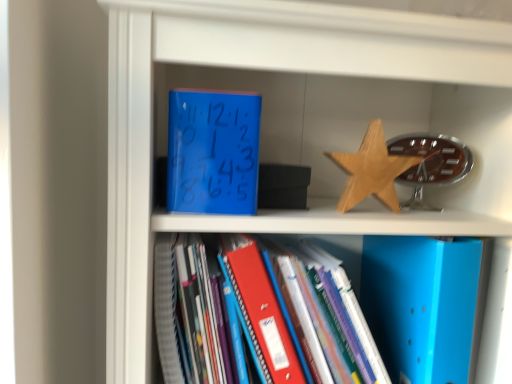
Describe the element at coordinates (422, 304) in the screenshot. I see `blue matte folder at lower right, which is the second paperback book from top to bottom` at that location.

Identify the location of blue matte folder at center. (259, 314).

From the image's perspective, which one is positioned lower, blue matte folder at lower right, which is the second paperback book from top to bottom, or wooden star at upper right?

From the image's view, blue matte folder at lower right, which is the second paperback book from top to bottom, is below.

Does point (458, 350) lie behind point (378, 161)?

That is False.

Which is more to the left, blue matte folder at lower right, which is the second paperback book from top to bottom, or wooden star at upper right?

wooden star at upper right.

Is blue matte folder at lower right, which is the second paperback book from top to bottom, turned away from wooden star at upper right?

blue matte folder at lower right, which is the second paperback book from top to bottom, does not have its back to wooden star at upper right.

Which object is closer to the camera taking this photo, blue matte clock at upper center, which is the 1th paperback book in left-to-right order, or blue matte folder at lower right, which is the second paperback book from top to bottom?

blue matte clock at upper center, which is the 1th paperback book in left-to-right order, is more forward.

From the image's perspective, which object appears higher, blue matte clock at upper center, placed as the second paperback book when sorted from bottom to top, or blue matte folder at lower right, the first paperback book ordered from the bottom?

blue matte clock at upper center, placed as the second paperback book when sorted from bottom to top, from the image's perspective.

Based on their sizes in the image, would you say blue matte clock at upper center, which is the 1th paperback book in left-to-right order, is bigger or smaller than blue matte folder at lower right, acting as the first paperback book starting from the right?

Considering their sizes, blue matte clock at upper center, which is the 1th paperback book in left-to-right order, takes up less space than blue matte folder at lower right, acting as the first paperback book starting from the right.

Is blue matte folder at lower right, acting as the first paperback book starting from the right, inside or outside of blue matte folder at center?

blue matte folder at lower right, acting as the first paperback book starting from the right, is not enclosed by blue matte folder at center.

From a real-world perspective, which is physically above, blue matte folder at lower right, which ranks as the second paperback book in left-to-right order, or blue matte folder at center?

blue matte folder at lower right, which ranks as the second paperback book in left-to-right order, from a real-world perspective.

From the image's perspective, is blue matte folder at lower right, the first paperback book ordered from the bottom, under blue matte folder at center?

Actually, blue matte folder at lower right, the first paperback book ordered from the bottom, appears above blue matte folder at center in the image.

Is blue matte folder at lower right, which is the second paperback book from top to bottom, facing away from blue matte folder at center?

No, blue matte folder at lower right, which is the second paperback book from top to bottom, is not facing away from blue matte folder at center.

Is blue matte clock at upper center, the first paperback book from the top, completely or partially outside of blue matte folder at center?

Yes, blue matte clock at upper center, the first paperback book from the top, is outside of blue matte folder at center.

In terms of width, does blue matte clock at upper center, which is the 1th paperback book in left-to-right order, look wider or thinner when compared to blue matte folder at center?

Considering their sizes, blue matte clock at upper center, which is the 1th paperback book in left-to-right order, looks slimmer than blue matte folder at center.

In the image, is blue matte clock at upper center, which is the 1th paperback book in left-to-right order, positioned in front of or behind blue matte folder at center?

blue matte clock at upper center, which is the 1th paperback book in left-to-right order, is behind blue matte folder at center.

The width and height of the screenshot is (512, 384). I want to click on paperback book that appears on the left of blue matte folder at center, so click(213, 152).

Considering the sizes of objects blue matte folder at center and blue matte clock at upper center, the first paperback book from the top, in the image provided, who is smaller, blue matte folder at center or blue matte clock at upper center, the first paperback book from the top,?

blue matte clock at upper center, the first paperback book from the top, is smaller.

Image resolution: width=512 pixels, height=384 pixels. In order to click on book directly beneath the blue matte clock at upper center, which is the 1th paperback book in left-to-right order (from a real-world perspective) in this screenshot , I will do `click(259, 314)`.

Looking at their sizes, would you say blue matte folder at center is wider or thinner than blue matte clock at upper center, which is the 1th paperback book in left-to-right order?

In the image, blue matte folder at center appears to be wider than blue matte clock at upper center, which is the 1th paperback book in left-to-right order.

You are a GUI agent. You are given a task and a screenshot of the screen. Output one action in this format:
    pyautogui.click(x=<x>, y=<y>)
    Task: Click on the star on the right of blue matte folder at center
    Image resolution: width=512 pixels, height=384 pixels.
    Given the screenshot: What is the action you would take?
    pyautogui.click(x=372, y=170)

Between wooden star at upper right and blue matte folder at center, which one has less height?

wooden star at upper right is shorter.

From the image's perspective, would you say wooden star at upper right is shown under blue matte folder at center?

No, from the image's perspective, wooden star at upper right is not beneath blue matte folder at center.

Is wooden star at upper right positioned far away from blue matte folder at center?

wooden star at upper right is near blue matte folder at center, not far away.

Is wooden star at upper right to the left of blue matte folder at lower right, which is the second paperback book from top to bottom, from the viewer's perspective?

Yes, wooden star at upper right is to the left of blue matte folder at lower right, which is the second paperback book from top to bottom.

In the scene shown: From the image's perspective, between wooden star at upper right and blue matte folder at lower right, acting as the first paperback book starting from the right, which one is located above?

wooden star at upper right appears higher in the image.

Who is smaller, wooden star at upper right or blue matte folder at lower right, which ranks as the second paperback book in left-to-right order?

Smaller between the two is wooden star at upper right.

From a real-world perspective, which object rests below the other?

blue matte folder at lower right, acting as the first paperback book starting from the right, from a real-world perspective.

This screenshot has width=512, height=384. What are the coordinates of `paperback book below the wooden star at upper right (from a real-world perspective)` in the screenshot? It's located at (422, 304).

Locate an element on the screen. Image resolution: width=512 pixels, height=384 pixels. paperback book that appears behind the blue matte clock at upper center, the second paperback book in the right-to-left sequence is located at coordinates (422, 304).

In the scene shown: Which object lies nearer to the anchor point blue matte clock at upper center, which is the 1th paperback book in left-to-right order, wooden star at upper right or blue matte folder at center?

Among the two, blue matte folder at center is located nearer to blue matte clock at upper center, which is the 1th paperback book in left-to-right order.

Considering their positions, is blue matte clock at upper center, the first paperback book from the top, positioned closer to wooden star at upper right than blue matte folder at lower right, the first paperback book ordered from the bottom?

blue matte folder at lower right, the first paperback book ordered from the bottom, is positioned closer to the anchor wooden star at upper right.

Based on the photo, looking at the image, which one is located further to blue matte folder at lower right, which is the second paperback book from top to bottom, blue matte folder at center or wooden star at upper right?

blue matte folder at center.

Based on their spatial positions, is blue matte clock at upper center, placed as the second paperback book when sorted from bottom to top, or blue matte folder at center closer to wooden star at upper right?

blue matte clock at upper center, placed as the second paperback book when sorted from bottom to top, lies closer to wooden star at upper right than the other object.

Looking at this image, looking at the image, which one is located closer to blue matte folder at lower right, which is the second paperback book from top to bottom, wooden star at upper right or blue matte clock at upper center, the first paperback book from the top?

wooden star at upper right is closer to blue matte folder at lower right, which is the second paperback book from top to bottom.

Looking at the image, which one is located further to blue matte folder at center, blue matte clock at upper center, the second paperback book in the right-to-left sequence, or wooden star at upper right?

Among the two, wooden star at upper right is located further to blue matte folder at center.

Considering their positions, is wooden star at upper right positioned further to blue matte clock at upper center, the second paperback book in the right-to-left sequence, than blue matte folder at lower right, the first paperback book ordered from the bottom?

blue matte folder at lower right, the first paperback book ordered from the bottom, is positioned further to the anchor blue matte clock at upper center, the second paperback book in the right-to-left sequence.

From the image, which object appears to be nearer to blue matte folder at lower right, which ranks as the second paperback book in left-to-right order, blue matte folder at center or blue matte clock at upper center, placed as the second paperback book when sorted from bottom to top?

Based on the image, blue matte folder at center appears to be nearer to blue matte folder at lower right, which ranks as the second paperback book in left-to-right order.

Locate an element on the screen. This screenshot has width=512, height=384. star between blue matte clock at upper center, which is the 1th paperback book in left-to-right order, and blue matte folder at center vertically is located at coordinates (372, 170).

Locate an element on the screen. book between blue matte clock at upper center, the first paperback book from the top, and blue matte folder at lower right, which is the second paperback book from top to bottom, from left to right is located at coordinates (259, 314).

The width and height of the screenshot is (512, 384). I want to click on star between blue matte clock at upper center, which is the 1th paperback book in left-to-right order, and blue matte folder at lower right, which is the second paperback book from top to bottom, from left to right, so click(372, 170).

Image resolution: width=512 pixels, height=384 pixels. I want to click on paperback book between wooden star at upper right and blue matte folder at center from top to bottom, so click(x=422, y=304).